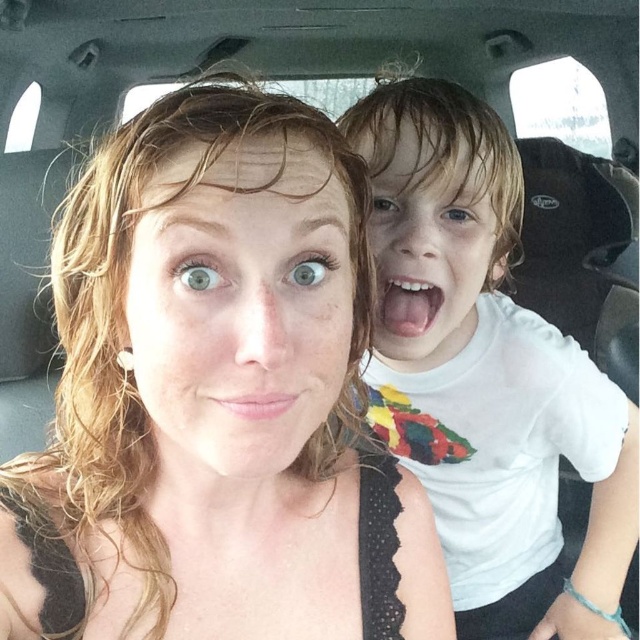
Question: Estimate the real-world distances between objects in this image. Which object is farther from the pink glossy tongue at center?

Choices:
 (A) natural skin tone at center
 (B) matte black tank top at center
 (C) pink smooth lips at center

Answer: (C)

Question: Is natural skin tone at center wider than white matte face at upper right?

Choices:
 (A) yes
 (B) no

Answer: (B)

Question: Which point is farther from the camera taking this photo?

Choices:
 (A) (280, 164)
 (B) (243, 412)
 (C) (492, 429)
 (D) (228, 465)

Answer: (C)

Question: Among these points, which one is farthest from the camera?

Choices:
 (A) (218, 244)
 (B) (356, 108)

Answer: (B)

Question: Can you confirm if natural skin tone at center is wider than white matte face at upper right?

Choices:
 (A) no
 (B) yes

Answer: (A)

Question: Does white matte face at upper right appear under pink smooth lips at center?

Choices:
 (A) no
 (B) yes

Answer: (A)